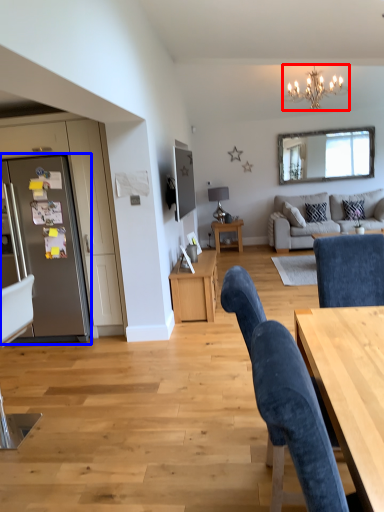
Question: Which point is closer to the camera, lamp (highlighted by a red box) or fridge (highlighted by a blue box)?

Choices:
 (A) lamp
 (B) fridge

Answer: (B)